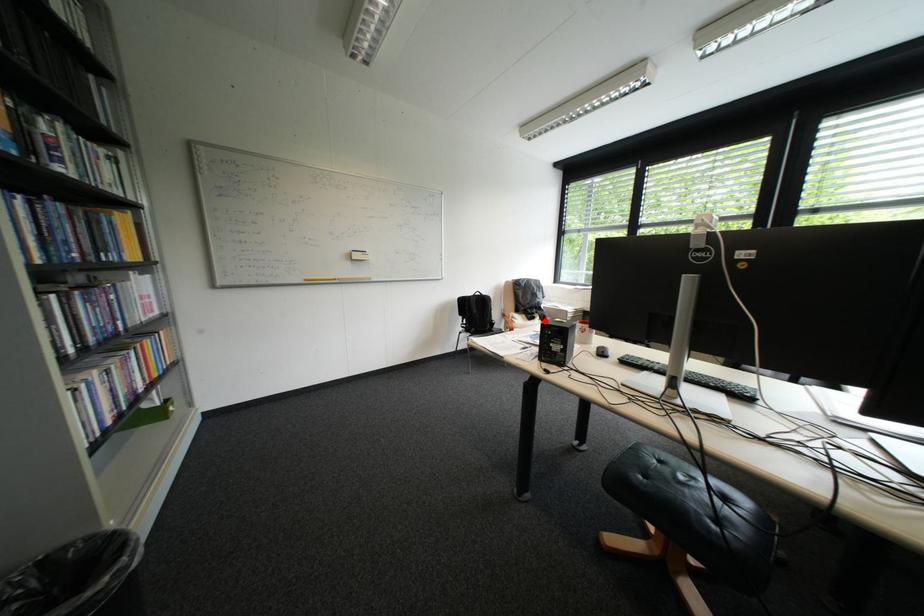
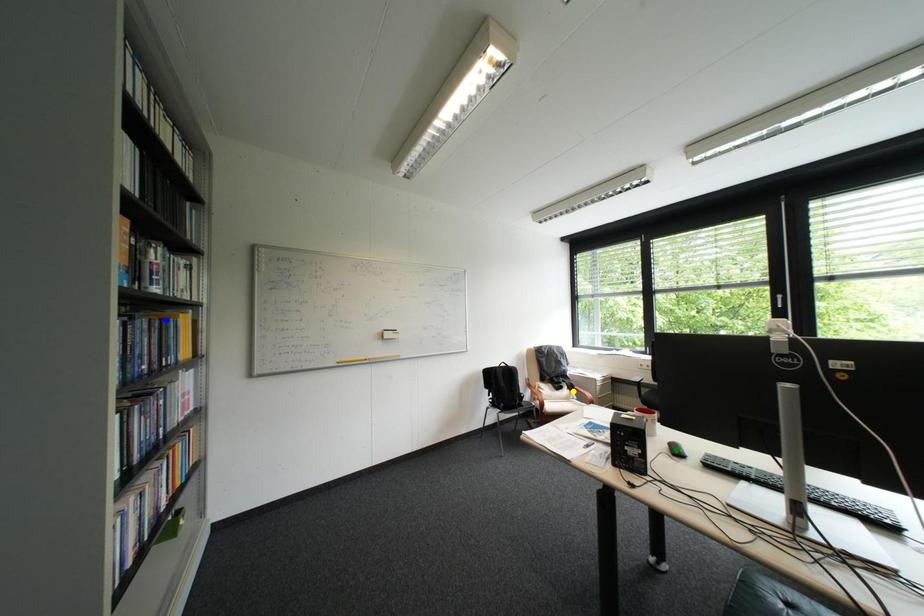
Question: I am providing you with two images of the same scene from different viewpoints. A red point is marked on the first image. You are given multiple points on the second image. Which spot in image 2 lines up with the point in image 1?

Choices:
 (A) green point
 (B) blue point
 (C) yellow point

Answer: (C)